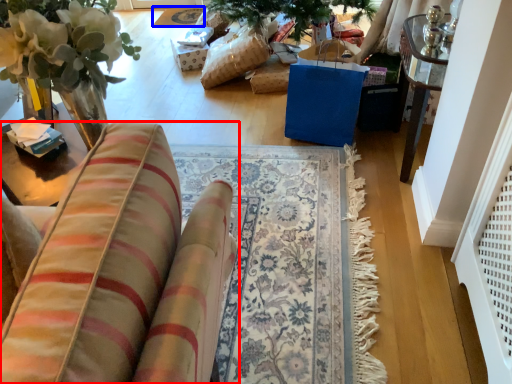
Question: Among these objects, which one is nearest to the camera, furniture (highlighted by a red box) or mat (highlighted by a blue box)?

Choices:
 (A) furniture
 (B) mat

Answer: (A)